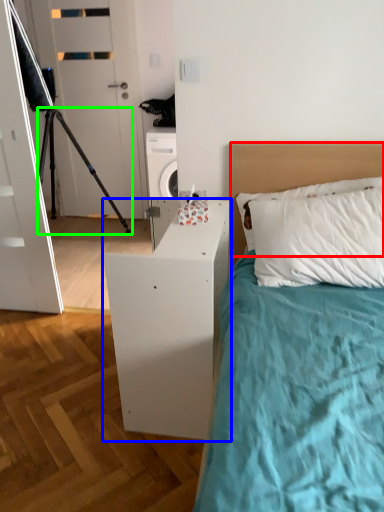
Question: Considering the real-world distances, which object is farthest from headboard (highlighted by a red box)? nightstand (highlighted by a blue box) or tripod (highlighted by a green box)?

Choices:
 (A) nightstand
 (B) tripod

Answer: (B)